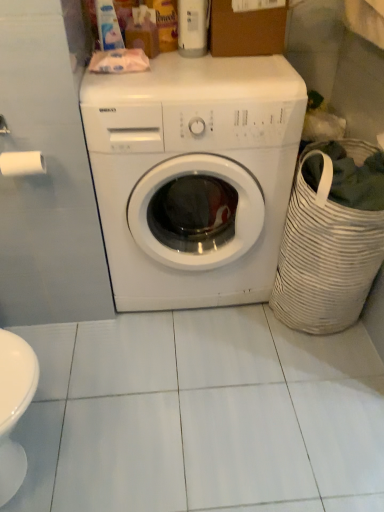
Question: Should I look upward or downward to see white matte toilet paper at left?

Choices:
 (A) up
 (B) down

Answer: (A)

Question: Does white glossy washing machine at center have a greater height compared to white matte toilet paper at left?

Choices:
 (A) yes
 (B) no

Answer: (A)

Question: Is white glossy washing machine at center positioned beyond the bounds of white matte toilet paper at left?

Choices:
 (A) yes
 (B) no

Answer: (A)

Question: Does white glossy washing machine at center appear on the left side of white matte toilet paper at left?

Choices:
 (A) no
 (B) yes

Answer: (A)

Question: From a real-world perspective, is white glossy washing machine at center over white matte toilet paper at left?

Choices:
 (A) yes
 (B) no

Answer: (B)

Question: Is white glossy washing machine at center in contact with white matte toilet paper at left?

Choices:
 (A) no
 (B) yes

Answer: (A)

Question: Is white glossy washing machine at center facing towards white matte toilet paper at left?

Choices:
 (A) yes
 (B) no

Answer: (B)

Question: Considering the relative positions of white matte toilet paper at left and white glossy washing machine at center in the image provided, is white matte toilet paper at left behind white glossy washing machine at center?

Choices:
 (A) yes
 (B) no

Answer: (A)

Question: Can you see white matte toilet paper at left touching white glossy washing machine at center?

Choices:
 (A) yes
 (B) no

Answer: (B)

Question: From the image's perspective, is white matte toilet paper at left beneath white glossy washing machine at center?

Choices:
 (A) no
 (B) yes

Answer: (B)

Question: Is white matte toilet paper at left bigger than white glossy washing machine at center?

Choices:
 (A) no
 (B) yes

Answer: (A)

Question: Does white matte toilet paper at left appear on the left side of white glossy washing machine at center?

Choices:
 (A) yes
 (B) no

Answer: (A)

Question: Is the depth of white matte toilet paper at left less than that of white glossy washing machine at center?

Choices:
 (A) no
 (B) yes

Answer: (A)

Question: Does white woven laundry basket at right have a lesser width compared to brown cardboard box at upper center?

Choices:
 (A) no
 (B) yes

Answer: (A)